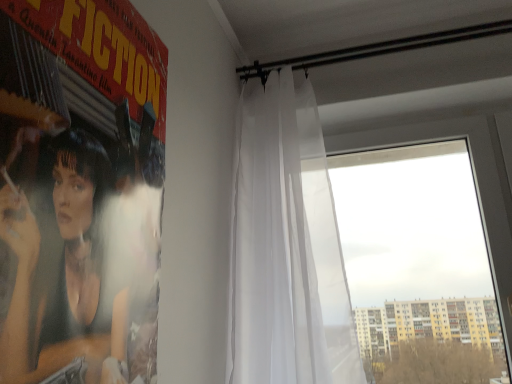
Question: Is transparent glass window at right inside or outside of white sheer curtain at upper center?

Choices:
 (A) inside
 (B) outside

Answer: (B)

Question: From their relative heights in the image, would you say transparent glass window at right is taller or shorter than white sheer curtain at upper center?

Choices:
 (A) short
 (B) tall

Answer: (A)

Question: Considering the real-world distances, which object is closest to the transparent glass window at right?

Choices:
 (A) matte black poster at left
 (B) white sheer curtain at upper center

Answer: (B)

Question: Estimate the real-world distances between objects in this image. Which object is closer to the matte black poster at left?

Choices:
 (A) transparent glass window at right
 (B) white sheer curtain at upper center

Answer: (B)